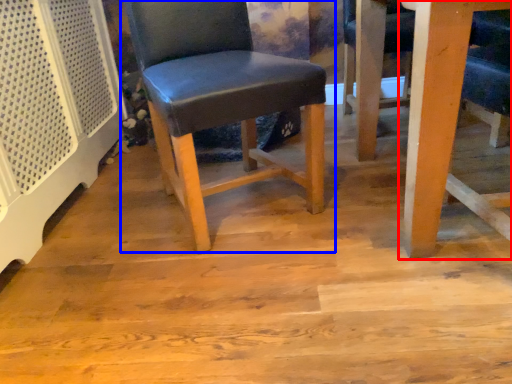
Question: Among these objects, which one is nearest to the camera, table (highlighted by a red box) or chair (highlighted by a blue box)?

Choices:
 (A) table
 (B) chair

Answer: (A)